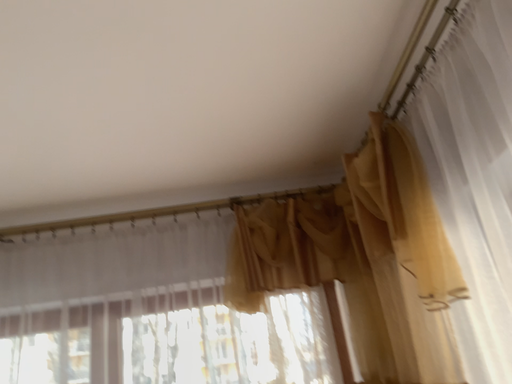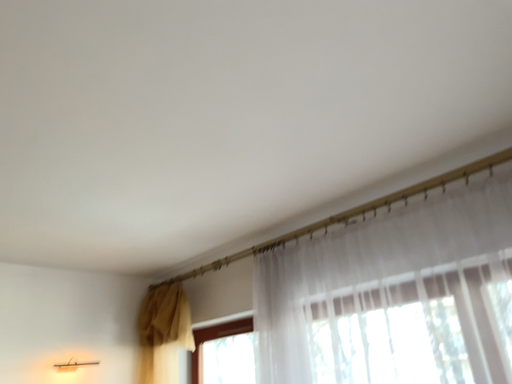
Question: Which way did the camera rotate in the video?

Choices:
 (A) rotated right
 (B) rotated left

Answer: (B)